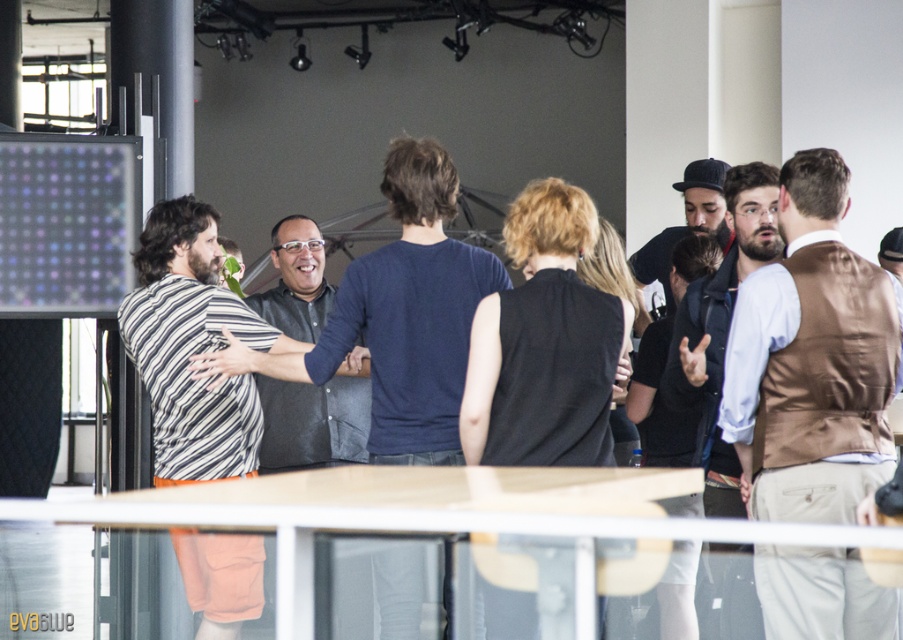
Question: Does brown satin vest at right appear on the right side of dark gray shirt at center?

Choices:
 (A) no
 (B) yes

Answer: (B)

Question: Does brown textured vest at right have a lesser width compared to dark gray shirt at center?

Choices:
 (A) no
 (B) yes

Answer: (A)

Question: Which point is closer to the camera?

Choices:
 (A) (706, 435)
 (B) (295, 304)
 (C) (873, 264)

Answer: (C)

Question: Can you confirm if brown satin vest at right is positioned to the left of brown textured vest at right?

Choices:
 (A) no
 (B) yes

Answer: (A)

Question: Which of these objects is positioned closest to the dark gray shirt at center?

Choices:
 (A) brown satin vest at right
 (B) brown textured vest at right

Answer: (B)

Question: Which point is farther from the camera taking this photo?

Choices:
 (A) (827, 154)
 (B) (701, 388)

Answer: (B)